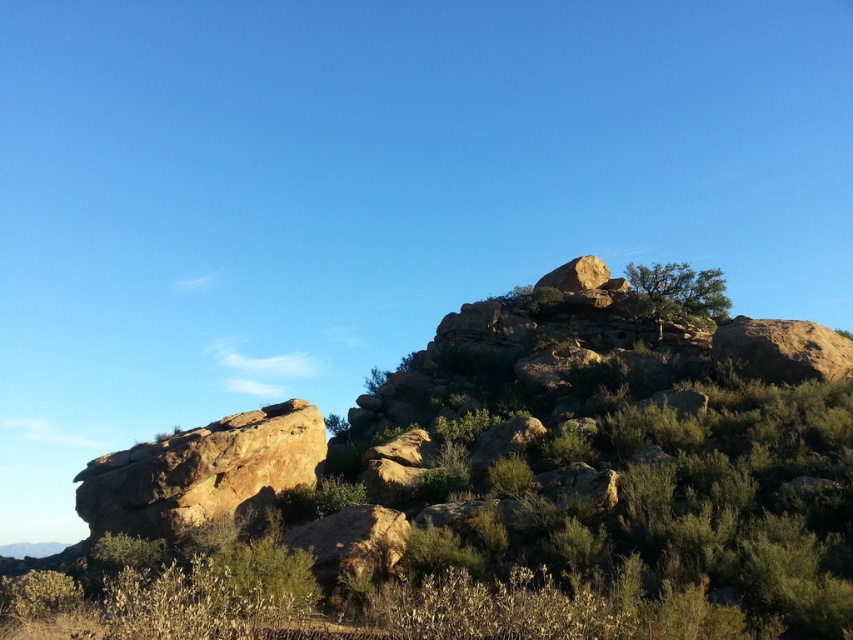
Does green leafy bush at upper right appear on the left side of rustic stone boulder at upper center?

Incorrect, green leafy bush at upper right is not on the left side of rustic stone boulder at upper center.

Does green leafy bush at upper right have a lesser height compared to rustic stone boulder at upper center?

Yes.

Where is `green leafy bush at upper right`? This screenshot has height=640, width=853. green leafy bush at upper right is located at coordinates (676, 292).

Who is lower down, brown rough rock at left or green leafy bush at upper right?

brown rough rock at left is below.

Between brown rough rock at left and green leafy bush at upper right, which one has less height?

green leafy bush at upper right is shorter.

Measure the distance between point (x=218, y=436) and camera.

A distance of 77.93 feet exists between point (x=218, y=436) and camera.

Identify the location of brown rough rock at left. This screenshot has width=853, height=640. (202, 472).

Can you confirm if green leafy shrubs at upper center is wider than brown rough rock at left?

Yes, green leafy shrubs at upper center is wider than brown rough rock at left.

Who is more distant from viewer, (753,339) or (202,492)?

Point (753,339)

I want to click on green leafy shrubs at upper center, so click(x=497, y=492).